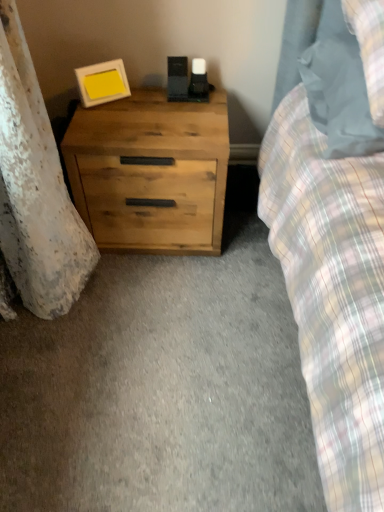
Locate an element on the screen. The height and width of the screenshot is (512, 384). vacant space to the right of matte white picture frame at upper left is located at coordinates click(157, 105).